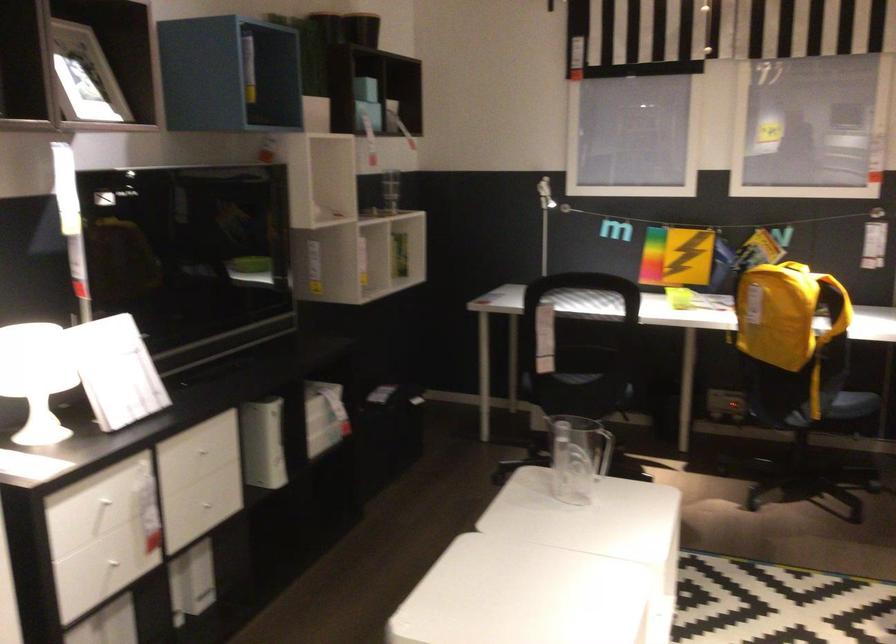
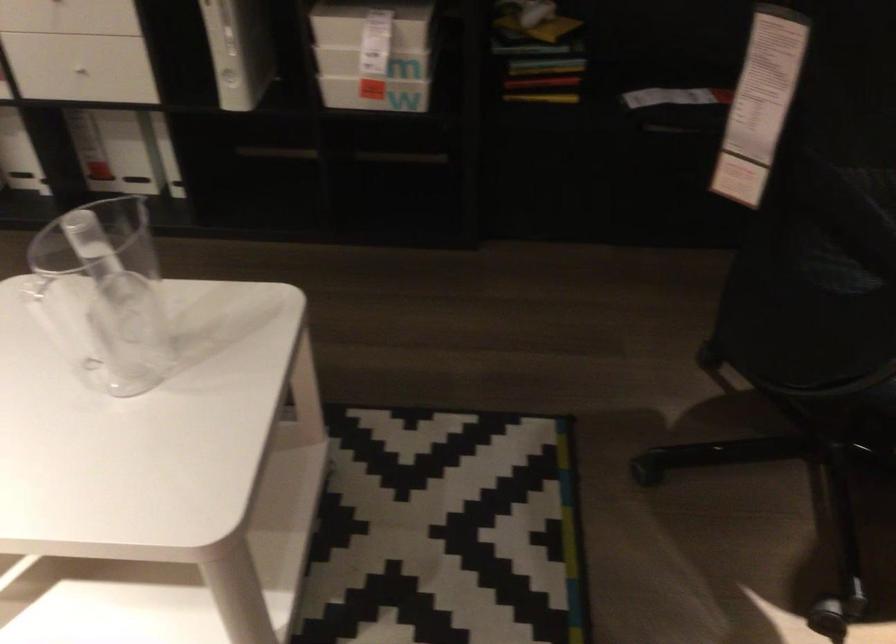
In the second image, find the point that corresponds to point 615,393 in the first image.

(837, 364)